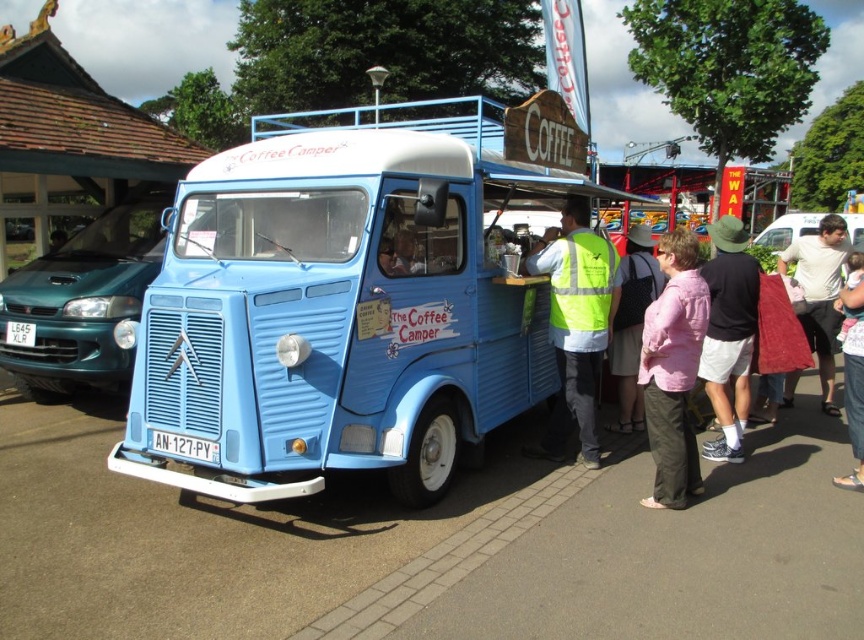
Question: Which object is the closest to the blue matte van at center?

Choices:
 (A) pink fabric jacket at lower center
 (B) white cotton shirt at center
 (C) high-visibility vest at center

Answer: (C)

Question: Does white cotton shirt at center appear on the left side of matte black coffee cup at center?

Choices:
 (A) no
 (B) yes

Answer: (A)

Question: Which point appears closest to the camera in this image?

Choices:
 (A) (556, 195)
 (B) (738, 451)
 (C) (386, 243)
 (D) (855, 323)

Answer: (C)

Question: Can you confirm if teal glossy sedan at left is positioned above matte black coffee cup at center?

Choices:
 (A) no
 (B) yes

Answer: (B)

Question: Which point is farther from the camera taking this photo?

Choices:
 (A) (669, 282)
 (B) (818, 358)
 (C) (99, 228)
 (D) (856, 428)

Answer: (C)

Question: Is white cotton shirt at center closer to the viewer compared to white cotton shirt at right?

Choices:
 (A) yes
 (B) no

Answer: (A)